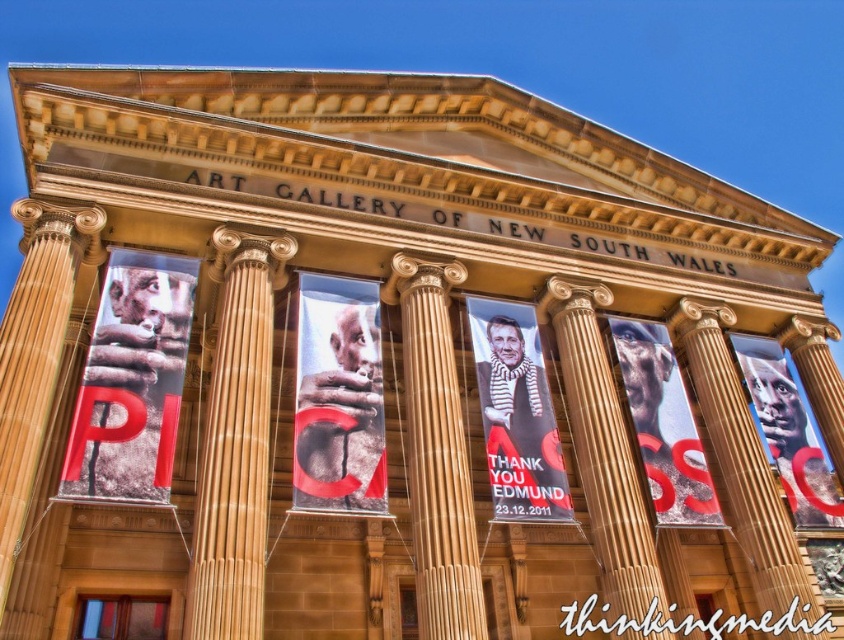
Does point (477, 627) come closer to viewer compared to point (588, 380)?

Yes, it is in front of point (588, 380).

Which of these two, golden stone column at center or brown stone column at center, stands taller?

Standing taller between the two is golden stone column at center.

Between point (425, 432) and point (615, 403), which one is positioned in front?

Point (425, 432)

Find the location of a particular element. The height and width of the screenshot is (640, 844). golden stone column at center is located at coordinates pyautogui.click(x=436, y=451).

Is sandy stone column at left to the left of golden stone pillar at center from the viewer's perspective?

Correct, you'll find sandy stone column at left to the left of golden stone pillar at center.

Image resolution: width=844 pixels, height=640 pixels. I want to click on sandy stone column at left, so click(35, 349).

The width and height of the screenshot is (844, 640). What do you see at coordinates (35, 349) in the screenshot? I see `sandy stone column at left` at bounding box center [35, 349].

You are a GUI agent. You are given a task and a screenshot of the screen. Output one action in this format:
    pyautogui.click(x=<x>, y=<y>)
    Task: Click on the sandy stone column at left
    This screenshot has width=844, height=640.
    Given the screenshot: What is the action you would take?
    pyautogui.click(x=35, y=349)

In the scene shown: Can you confirm if matte black banner at left is positioned to the left of golden stone pillar at center?

Correct, you'll find matte black banner at left to the left of golden stone pillar at center.

Between matte black banner at left and golden stone pillar at center, which one has more height?

Standing taller between the two is golden stone pillar at center.

Does point (134, 268) come in front of point (729, 428)?

Yes, point (134, 268) is in front of point (729, 428).

You are a GUI agent. You are given a task and a screenshot of the screen. Output one action in this format:
    pyautogui.click(x=<x>, y=<y>)
    Task: Click on the matte black banner at left
    The height and width of the screenshot is (640, 844).
    Given the screenshot: What is the action you would take?
    pyautogui.click(x=133, y=381)